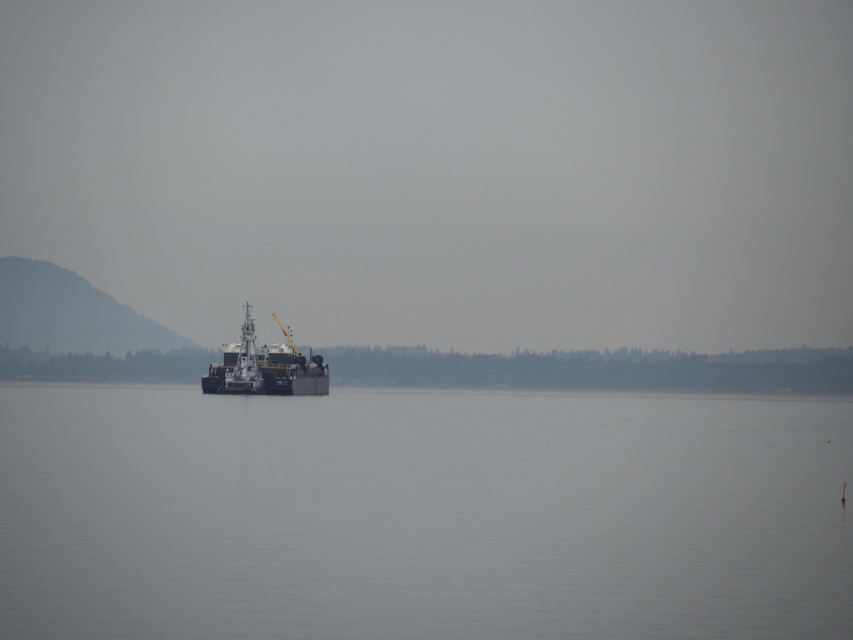
Based on the photo, which is below, gray water at center or metallic gray barge at center?

Positioned lower is gray water at center.

At what (x,y) coordinates should I click in order to perform the action: click on gray water at center. Please return your answer as a coordinate pair (x, y). Image resolution: width=853 pixels, height=640 pixels. Looking at the image, I should click on (421, 515).